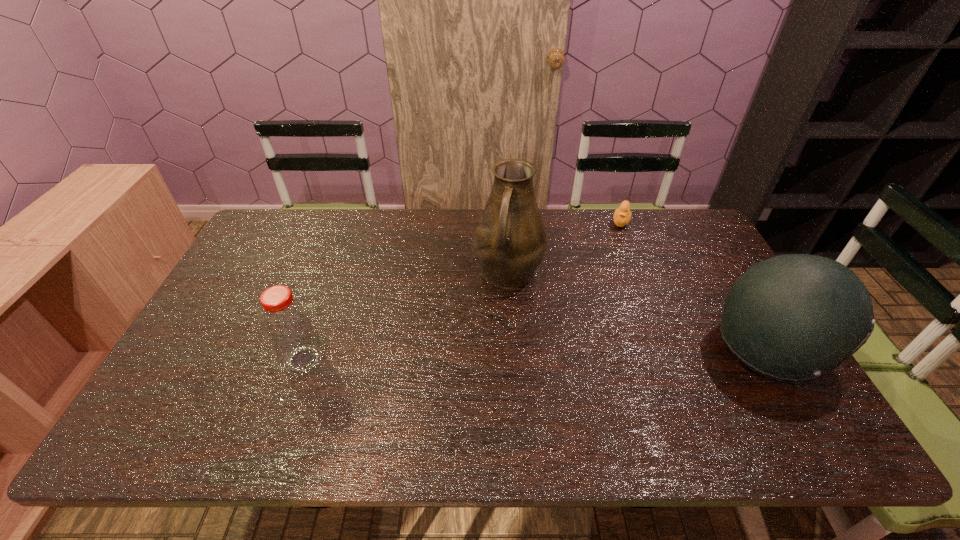
Where is `bottle`? bottle is located at coordinates (287, 324).

Where is `the third tallest object`? This screenshot has height=540, width=960. the third tallest object is located at coordinates (287, 324).

Identify the location of the second tallest object. The height and width of the screenshot is (540, 960). (794, 317).

At what (x,y) coordinates should I click in order to perform the action: click on the rightmost object. Please return your answer as a coordinate pair (x, y). The width and height of the screenshot is (960, 540). Looking at the image, I should click on (794, 317).

At what (x,y) coordinates should I click in order to perform the action: click on the farthest object. Please return your answer as a coordinate pair (x, y). Looking at the image, I should click on (622, 215).

You are a GUI agent. You are given a task and a screenshot of the screen. Output one action in this format:
    pyautogui.click(x=<x>, y=<y>)
    Task: Click on the duckling
    The width and height of the screenshot is (960, 540).
    Given the screenshot: What is the action you would take?
    pyautogui.click(x=622, y=215)

This screenshot has height=540, width=960. What are the coordinates of `pitcher` in the screenshot? It's located at (510, 240).

This screenshot has width=960, height=540. In order to click on the second object from left to right in this screenshot , I will do `click(510, 240)`.

The image size is (960, 540). In order to click on vacant space located 0.280m on the back of the bottle in this screenshot , I will do `click(334, 273)`.

At what (x,y) coordinates should I click in order to perform the action: click on free spot located 0.240m on the face of the shortest object. Please return your answer as a coordinate pair (x, y). This screenshot has width=960, height=540. Looking at the image, I should click on (x=607, y=273).